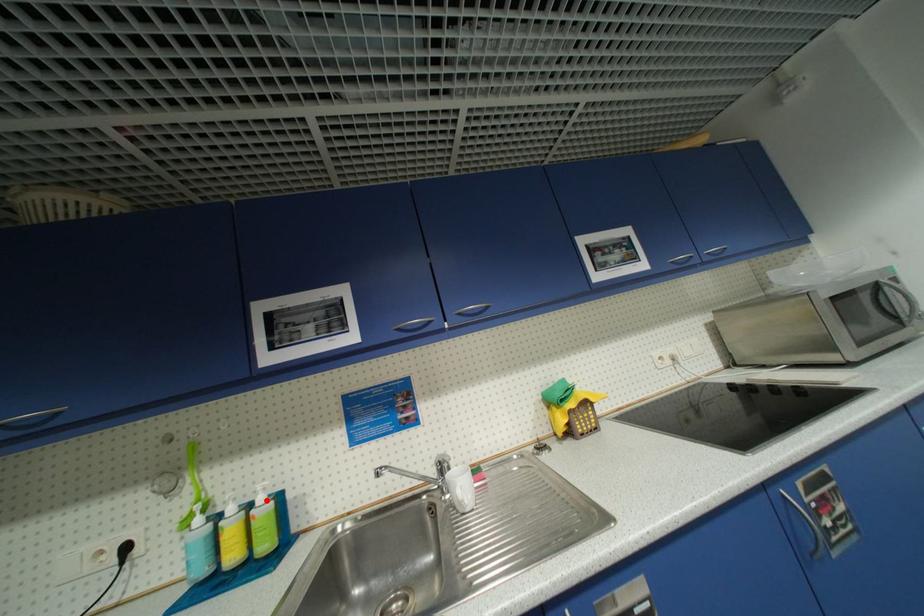
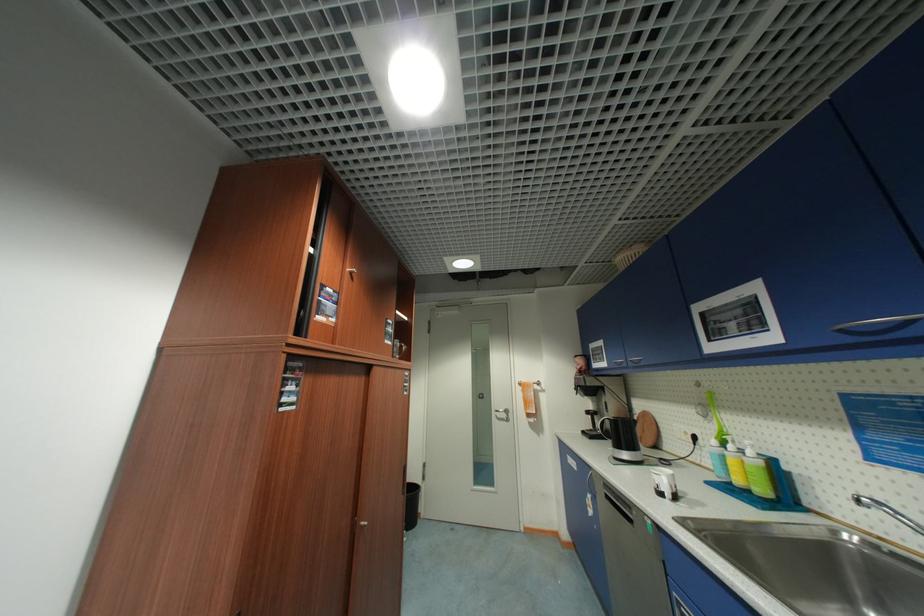
Question: I am providing you with two images of the same scene from different viewpoints. A red point is marked on the first image. At the location where the point appears in image 1, is it still visible in image 2?

Choices:
 (A) Yes
 (B) No

Answer: (A)